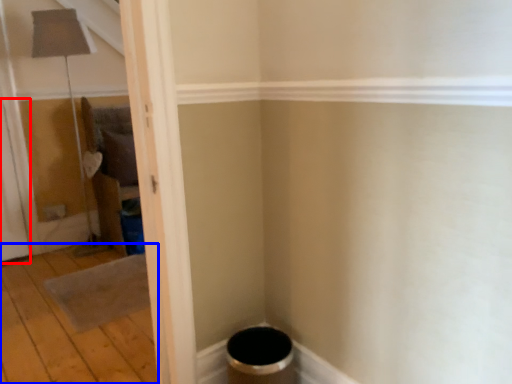
Question: Which object is closer to the camera taking this photo, screen door (highlighted by a red box) or plywood (highlighted by a blue box)?

Choices:
 (A) screen door
 (B) plywood

Answer: (B)